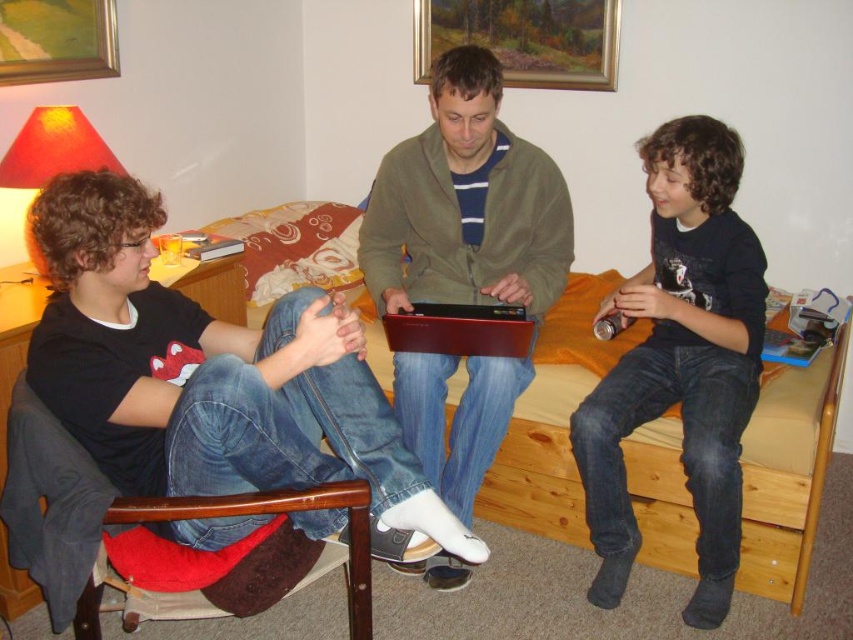
Question: Is wooden bed at center in front of wooden picture frame at upper center?

Choices:
 (A) no
 (B) yes

Answer: (B)

Question: Is matte green jacket at center wider than wooden picture frame at upper center?

Choices:
 (A) no
 (B) yes

Answer: (A)

Question: Can you confirm if matte green jacket at center is positioned below wooden bed at center?

Choices:
 (A) yes
 (B) no

Answer: (B)

Question: Which point is farther to the camera?

Choices:
 (A) (459, 332)
 (B) (772, 323)
 (C) (502, 387)
 (D) (608, 460)

Answer: (B)

Question: Which is nearer to the matte green jacket at center?

Choices:
 (A) brown wood chair at left
 (B) wooden picture frame at upper center

Answer: (B)

Question: Which object is the farthest from the wooden bed at center?

Choices:
 (A) red matte laptop at center
 (B) brown wood chair at left

Answer: (B)